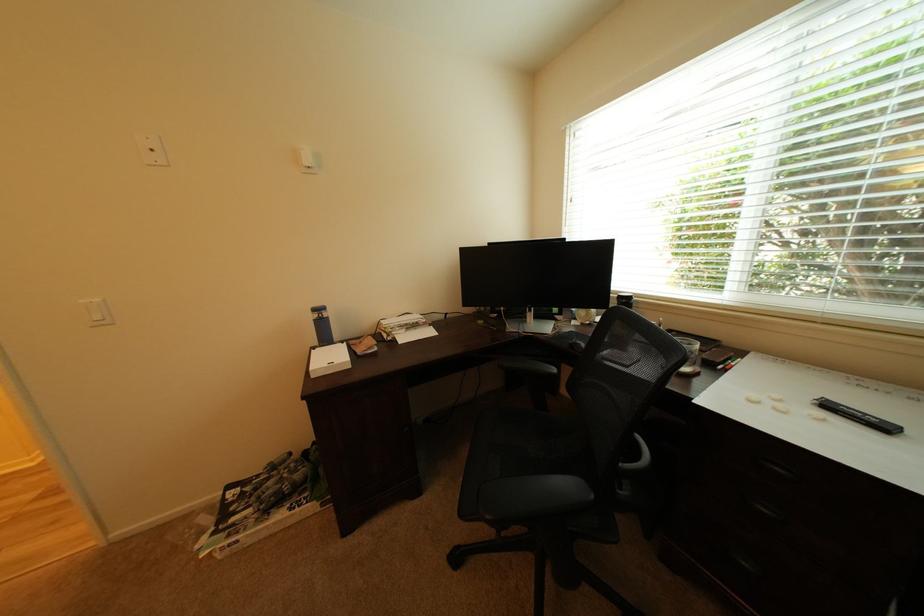
Locate an element on the screen. This screenshot has width=924, height=616. chair sitting surface is located at coordinates (538, 444).